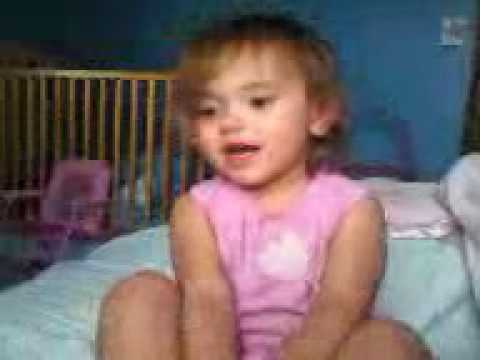
Identify the location of mattress. (125, 256).